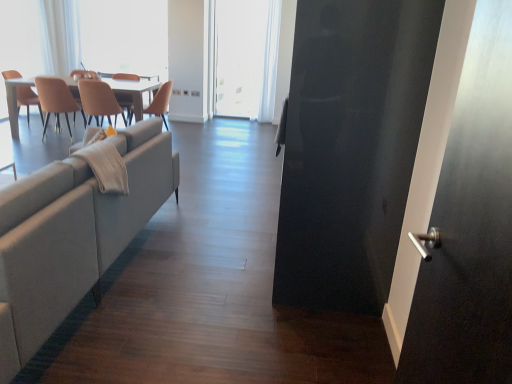
In order to click on free location to the right of light gray fabric couch at left in this screenshot , I will do `click(217, 247)`.